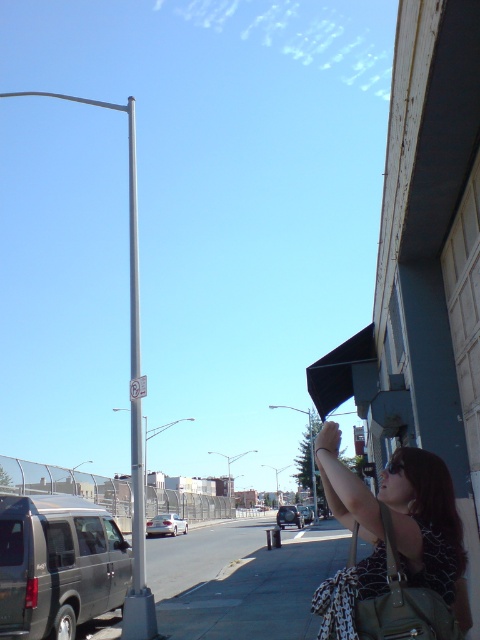
Does leopard print dress at lower right have a greater width compared to silver metallic sedan at center?

No, leopard print dress at lower right is not wider than silver metallic sedan at center.

Between leopard print dress at lower right and silver metallic sedan at center, which one is positioned higher?

Positioned higher is leopard print dress at lower right.

Which is behind, point (447, 593) or point (156, 522)?

Positioned behind is point (156, 522).

This screenshot has width=480, height=640. Find the location of `leopard print dress at lower right`. leopard print dress at lower right is located at coordinates (394, 529).

Who is positioned more to the right, matte black van at lower left or white plastic sign at center?

white plastic sign at center

Is point (58, 611) less distant than point (141, 376)?

Yes, point (58, 611) is in front of point (141, 376).

I want to click on matte black van at lower left, so click(58, 564).

Looking at this image, between leopard print dress at lower right and silver metallic car at center, which one has less height?

With less height is leopard print dress at lower right.

Between leopard print dress at lower right and silver metallic car at center, which one appears on the right side from the viewer's perspective?

silver metallic car at center

Describe the element at coordinates (394, 529) in the screenshot. I see `leopard print dress at lower right` at that location.

Image resolution: width=480 pixels, height=640 pixels. Find the location of `leopard print dress at lower right`. leopard print dress at lower right is located at coordinates (394, 529).